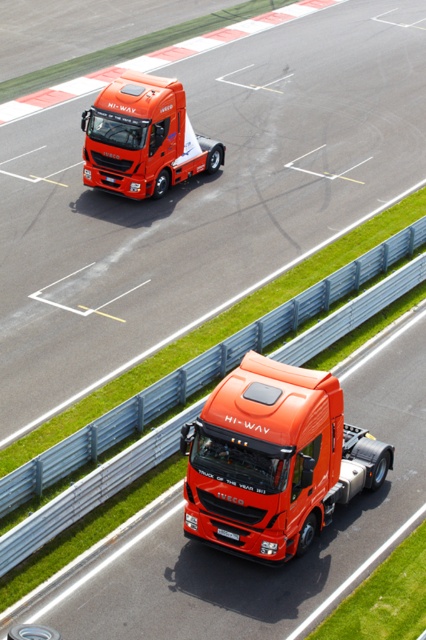
Who is taller, shiny orange truck at center or matte orange truck at upper left?

matte orange truck at upper left

How far apart are shiny orange truck at center and matte orange truck at upper left?

14.15 meters

Who is more forward, [310,506] or [138,193]?

Positioned in front is point [310,506].

Locate an element on the screen. The height and width of the screenshot is (640, 426). shiny orange truck at center is located at coordinates (275, 460).

Find the location of a particular element. matte orange truck at upper left is located at coordinates (143, 138).

Between matte orange truck at upper left and black plastic license plate at center, which one appears on the left side from the viewer's perspective?

matte orange truck at upper left is more to the left.

Between point (132, 193) and point (236, 538), which one is positioned behind?

The point (132, 193) is behind.

I want to click on matte orange truck at upper left, so click(x=143, y=138).

Between shiny orange truck at center and black plastic license plate at center, which one has less height?

Standing shorter between the two is black plastic license plate at center.

Is point (275, 465) less distant than point (216, 528)?

Yes, it is.

In order to click on shiny orange truck at center in this screenshot , I will do `click(275, 460)`.